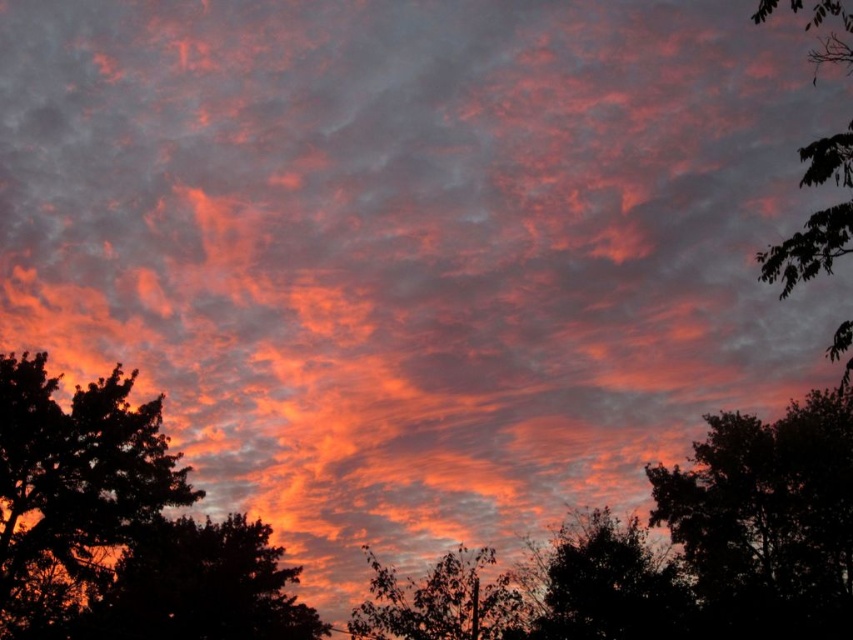
Question: Can you confirm if silhouette leafy tree at right is bigger than dark green leafy tree at lower left?

Choices:
 (A) yes
 (B) no

Answer: (B)

Question: Which point is closer to the camera?

Choices:
 (A) (471, 556)
 (B) (62, 422)
 (C) (585, 586)

Answer: (C)

Question: Does silhouette leafy tree at right have a larger size compared to dark green leafy tree at lower left?

Choices:
 (A) yes
 (B) no

Answer: (B)

Question: Does silhouette leafy tree at right appear on the right side of dark green leafy tree at lower left?

Choices:
 (A) yes
 (B) no

Answer: (A)

Question: Estimate the real-world distances between objects in this image. Which object is farther from the silhouette tree at left?

Choices:
 (A) dark green leafy tree at lower left
 (B) dark green leafy tree at lower right

Answer: (B)

Question: Estimate the real-world distances between objects in this image. Which object is closer to the dark green leafy tree at lower left?

Choices:
 (A) green leafy tree at right
 (B) silhouette leafy tree at right
 (C) silhouette tree at left
 (D) green leafy tree at center

Answer: (C)